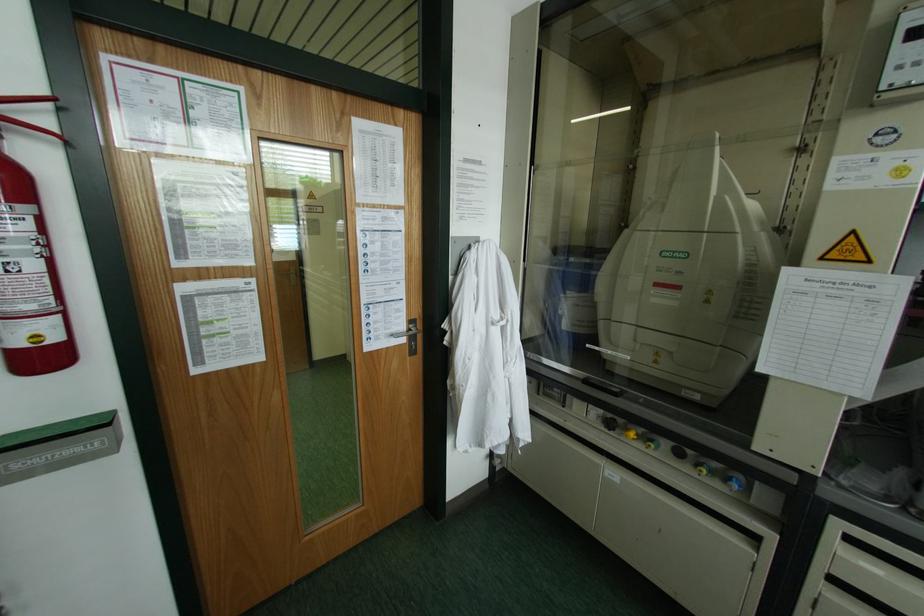
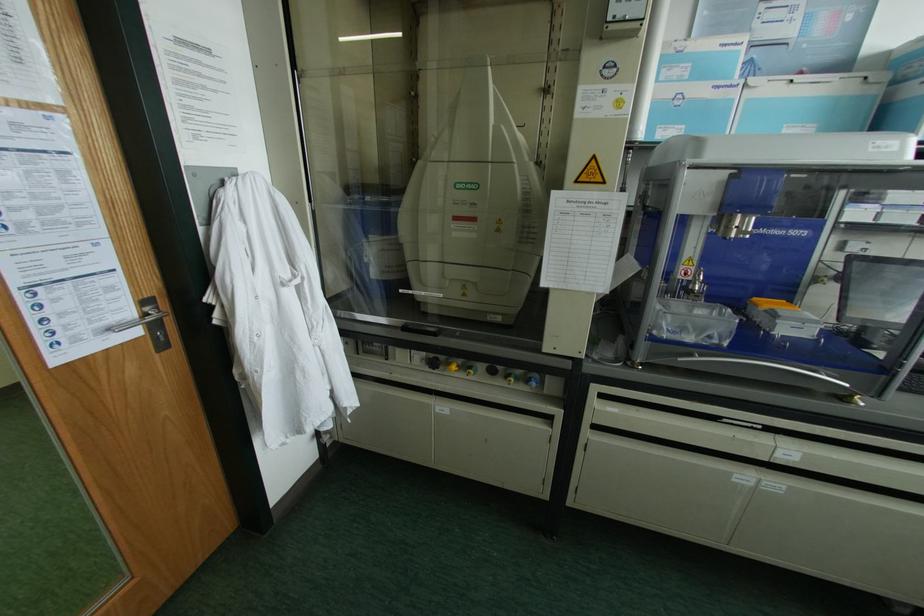
Find the pixel in the second image that matches the point at 409,321 in the first image.

(142, 302)